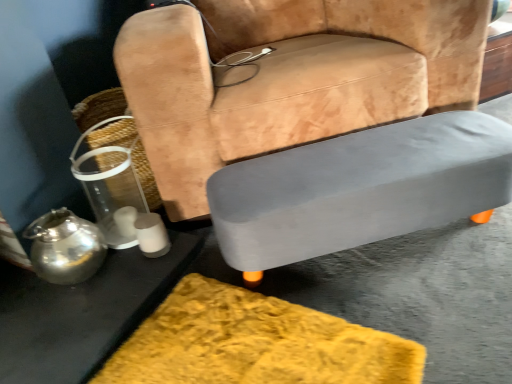
You are a GUI agent. You are given a task and a screenshot of the screen. Output one action in this format:
    pyautogui.click(x=<x>, y=<y>)
    Task: Click on the free space below gray matte table at lower right, the 2th table when ordered from left to right (from a real-world perspective)
    Image resolution: width=512 pixels, height=384 pixels.
    Given the screenshot: What is the action you would take?
    pyautogui.click(x=362, y=257)